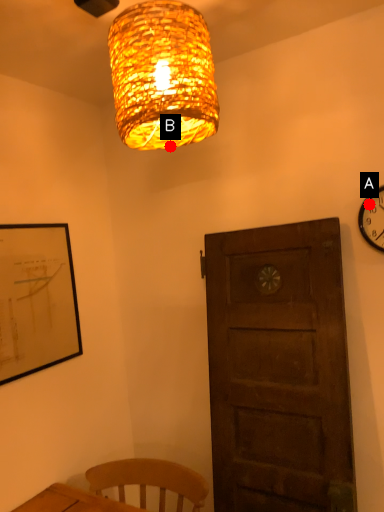
Question: Two points are circled on the image, labeled by A and B beside each circle. Among these points, which one is farthest from the camera?

Choices:
 (A) A is further
 (B) B is further

Answer: (A)